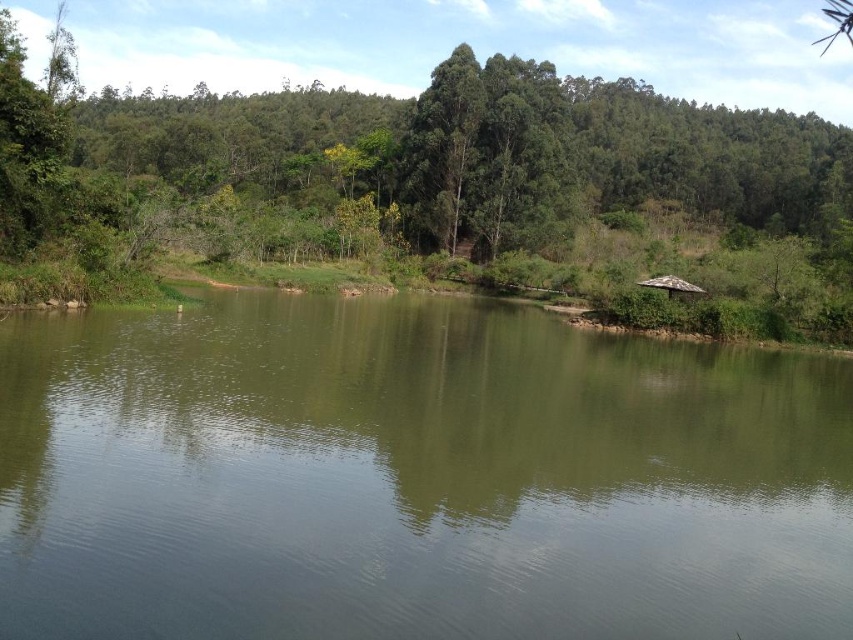
Question: Among these points, which one is farthest from the camera?

Choices:
 (A) (682, 291)
 (B) (67, 502)
 (C) (756, 284)

Answer: (C)

Question: In this image, where is green matte lake at center located relative to brown wooden hut at right?

Choices:
 (A) left
 (B) right

Answer: (A)

Question: Does green leafy tree at center have a greater width compared to brown wooden hut at right?

Choices:
 (A) no
 (B) yes

Answer: (B)

Question: Estimate the real-world distances between objects in this image. Which object is farther from the brown wooden hut at right?

Choices:
 (A) green leafy tree at center
 (B) green matte lake at center

Answer: (A)

Question: Among these points, which one is nearest to the camera?

Choices:
 (A) (666, 282)
 (B) (662, 593)

Answer: (B)

Question: Does green leafy tree at center appear over brown wooden hut at right?

Choices:
 (A) yes
 (B) no

Answer: (A)